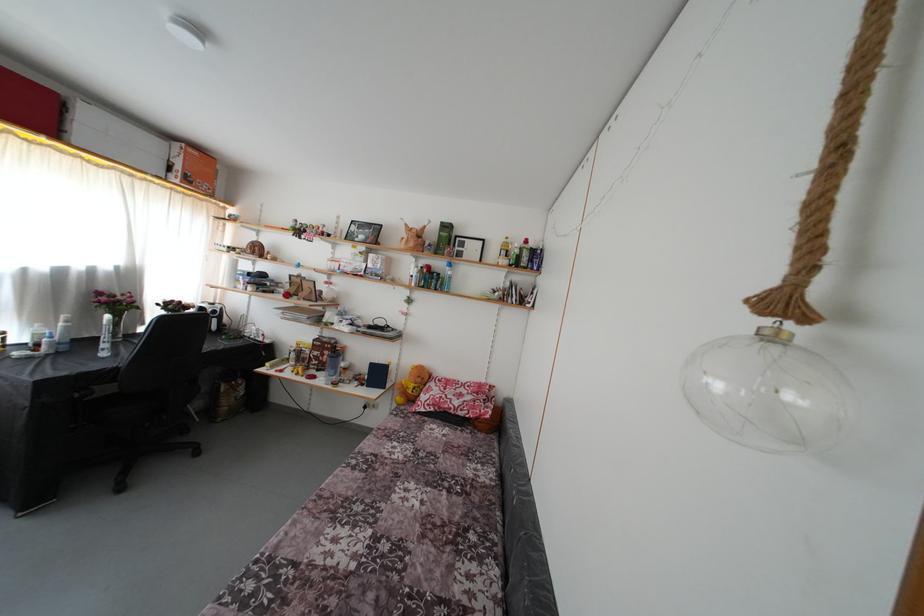
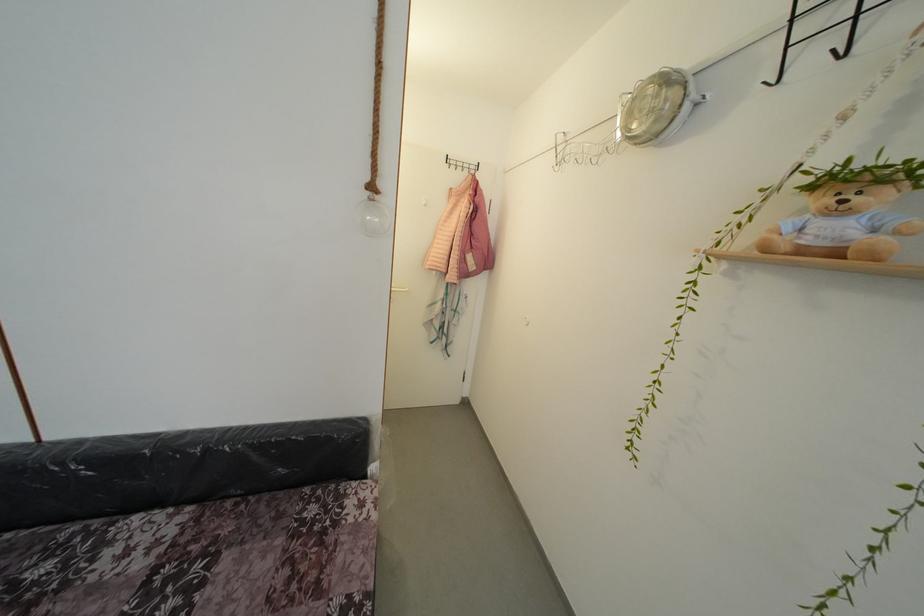
Based on the continuous images, in which direction is the camera rotating?

The rotation direction of the camera is right-down.